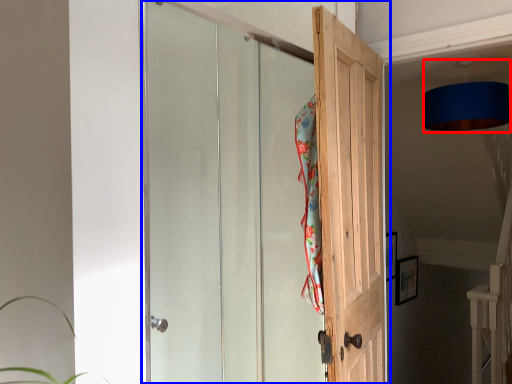
Question: Which point is further to the camera, lamp (highlighted by a red box) or door (highlighted by a blue box)?

Choices:
 (A) lamp
 (B) door

Answer: (A)